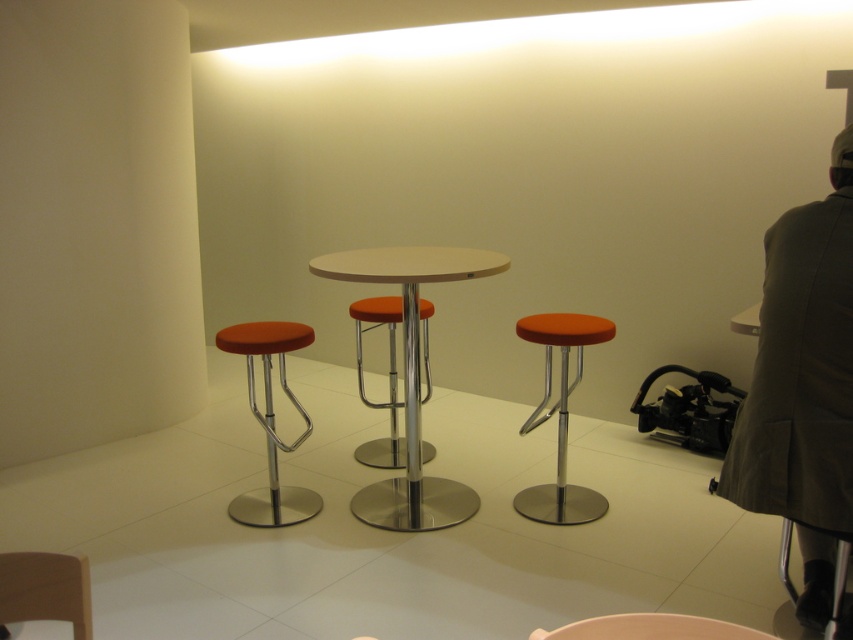
Question: Considering the real-world distances, which object is farthest from the dark olive-green coat at right?

Choices:
 (A) orange fabric bar stool at left
 (B) orange fabric stool at center
 (C) matte orange stool at center
 (D) wooden chair at lower left

Answer: (A)

Question: Does orange fabric stool at center have a smaller size compared to wooden chair at lower left?

Choices:
 (A) no
 (B) yes

Answer: (A)

Question: Which of these objects is positioned closest to the wooden chair at lower left?

Choices:
 (A) white glossy table at center
 (B) orange fabric bar stool at center
 (C) matte orange stool at center
 (D) orange fabric bar stool at left

Answer: (C)

Question: Can you confirm if orange fabric stool at center is positioned above orange fabric bar stool at center?

Choices:
 (A) yes
 (B) no

Answer: (B)

Question: Is dark olive-green coat at right above orange fabric bar stool at left?

Choices:
 (A) no
 (B) yes

Answer: (B)

Question: Estimate the real-world distances between objects in this image. Which object is closer to the white glossy table at center?

Choices:
 (A) orange fabric bar stool at left
 (B) orange fabric stool at center
 (C) wooden chair at lower left

Answer: (A)